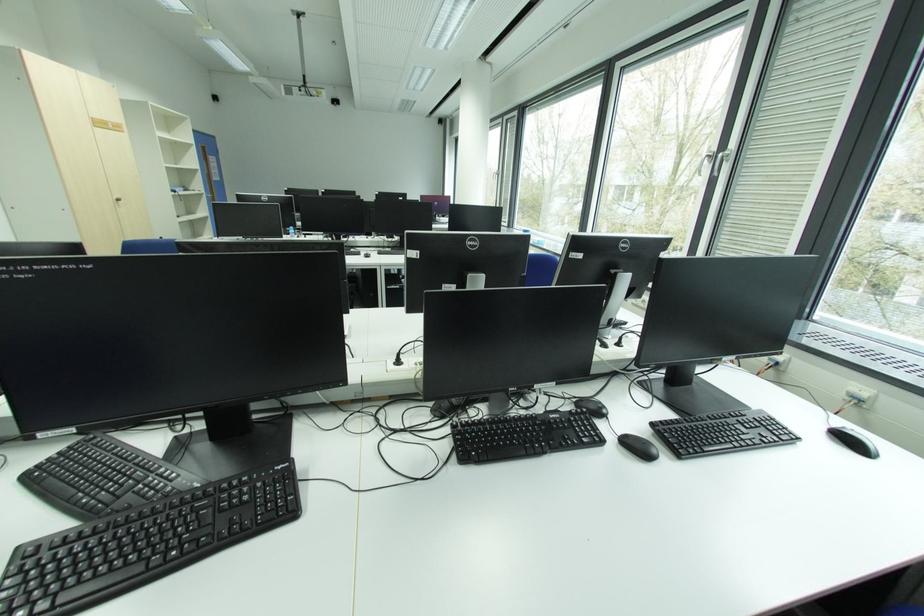
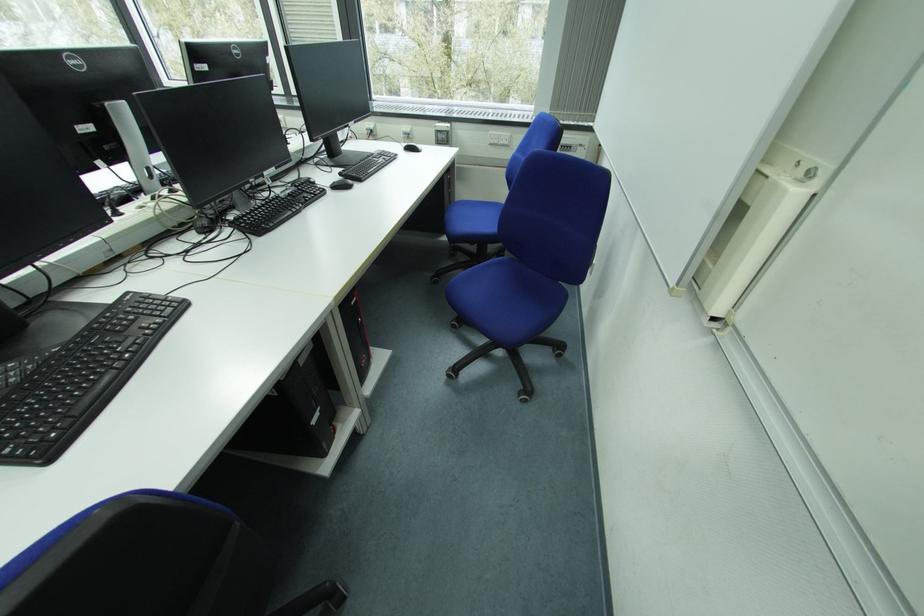
In the second image, find the point that corresponds to pixel 634 442 in the first image.

(342, 185)